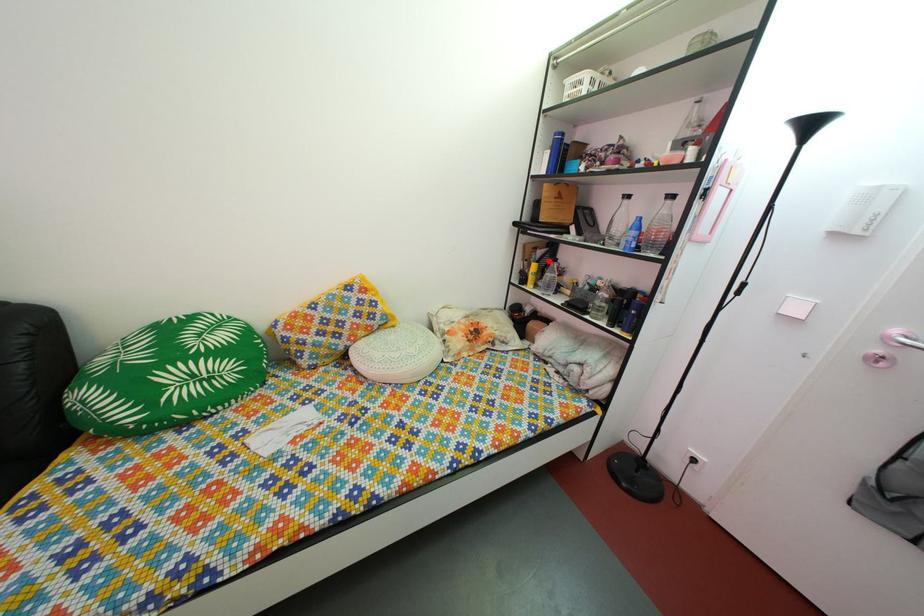
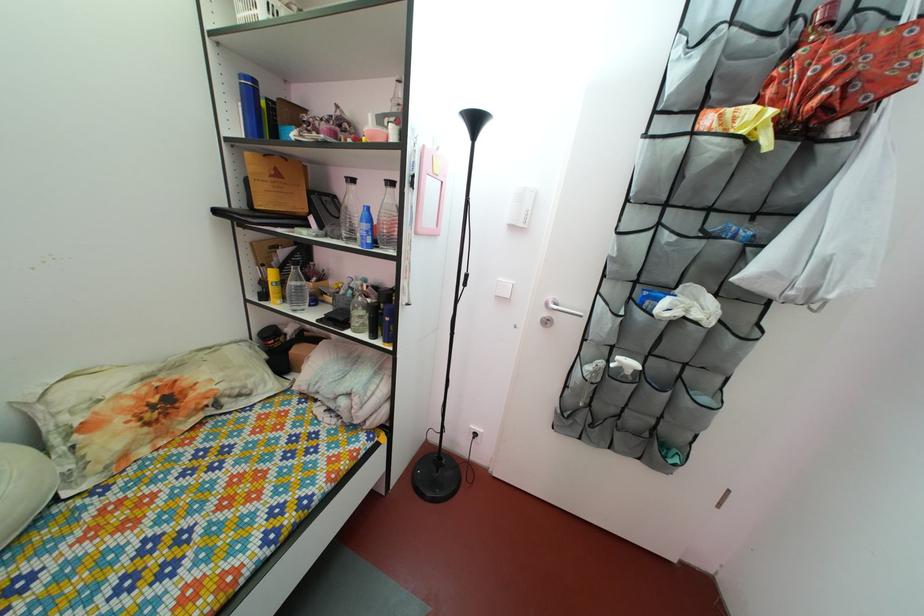
Find the pixel in the second image that matches the highlighted location in the first image.

(292, 262)